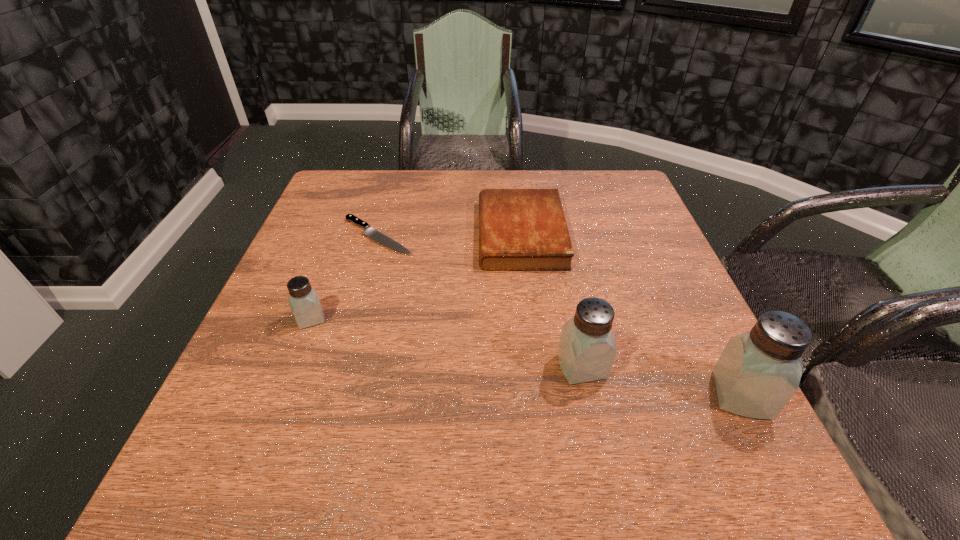
Locate an element on the screen. free point between the Bible and the farthest saltshaker is located at coordinates (416, 276).

The width and height of the screenshot is (960, 540). I want to click on empty location between the shortest object and the second saltshaker from right to left, so click(x=480, y=301).

The height and width of the screenshot is (540, 960). In order to click on vacant space that's between the shortest object and the rightmost object in this screenshot , I will do `click(560, 315)`.

The height and width of the screenshot is (540, 960). I want to click on free spot between the Bible and the second tallest object, so click(x=551, y=300).

Where is `vacant area between the steak knife and the third shortest object`? vacant area between the steak knife and the third shortest object is located at coordinates (345, 278).

The width and height of the screenshot is (960, 540). What are the coordinates of `object that is the closest to the farthest saltshaker` in the screenshot? It's located at (374, 234).

Select which object is the fourth closest to the rightmost object. Please provide its 2D coordinates. Your answer should be formatted as a tuple, i.e. [(x, y)], where the tuple contains the x and y coordinates of a point satisfying the conditions above.

[(304, 302)]

I want to click on saltshaker that is the second closest to the second tallest object, so click(304, 302).

Identify the location of saltshaker that can be found as the third closest to the Bible. [x=758, y=372].

Image resolution: width=960 pixels, height=540 pixels. I want to click on free spot that satisfies the following two spatial constraints: 1. on the front side of the steak knife; 2. on the right side of the fourth shortest object, so click(341, 367).